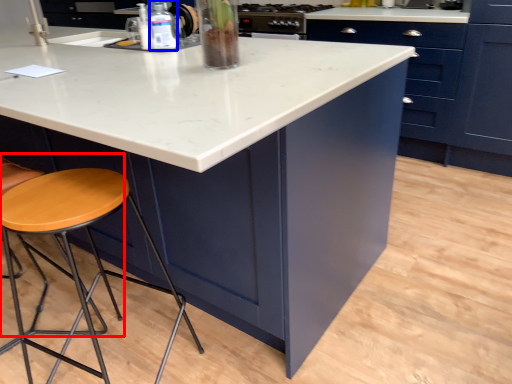
Question: Among these objects, which one is nearest to the camera, chair (highlighted by a red box) or bottle (highlighted by a blue box)?

Choices:
 (A) chair
 (B) bottle

Answer: (A)